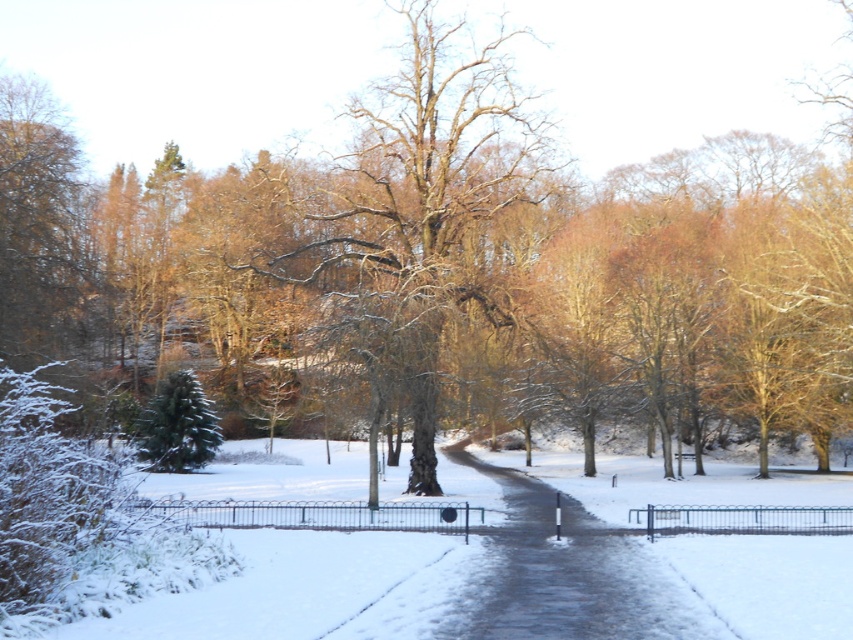
You are standing at the point labeled point (421, 212) in the winter scene. What object are you directly facing?

The point labeled point (421, 212) corresponds to a bare wood tree at center, so you are directly facing the bare wood tree at center.

You are planning to take a photo of the bare wood tree at center and the slick asphalt path at center in the winter scene. Which object is wider when viewed from your current position?

The bare wood tree at center is wider than the slick asphalt path at center.